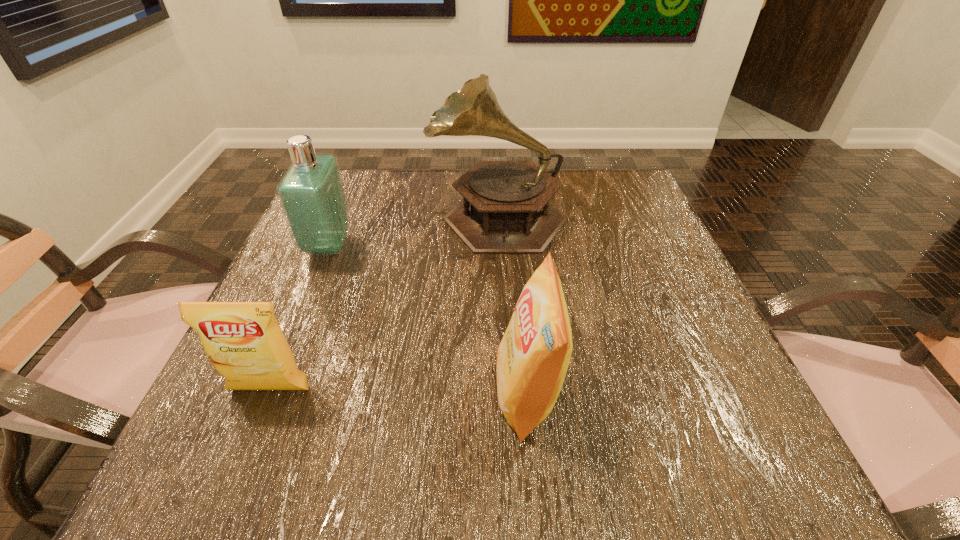
Where is `phonograph record`? The height and width of the screenshot is (540, 960). phonograph record is located at coordinates (505, 209).

The width and height of the screenshot is (960, 540). In order to click on perfume in this screenshot , I will do `click(311, 193)`.

What are the coordinates of `the right crisp (potato chip)` in the screenshot? It's located at (533, 356).

Locate an element on the screen. The width and height of the screenshot is (960, 540). the left crisp (potato chip) is located at coordinates (243, 340).

This screenshot has height=540, width=960. I want to click on free spot located on the horn direction of the phonograph record, so click(407, 215).

Identify the location of free space located 0.090m on the horn direction of the phonograph record. The width and height of the screenshot is (960, 540). (390, 215).

Find the location of a particular element. The width and height of the screenshot is (960, 540). free space located 0.070m on the horn direction of the phonograph record is located at coordinates pyautogui.click(x=398, y=215).

This screenshot has height=540, width=960. I want to click on vacant space located on the front label of the perfume, so click(x=392, y=246).

Find the location of a particular element. The image size is (960, 540). vacant region located on the front-facing side of the right crisp (potato chip) is located at coordinates pyautogui.click(x=244, y=394).

Where is `vacant space located 0.120m on the front-facing side of the right crisp (potato chip)`? Image resolution: width=960 pixels, height=540 pixels. vacant space located 0.120m on the front-facing side of the right crisp (potato chip) is located at coordinates (417, 394).